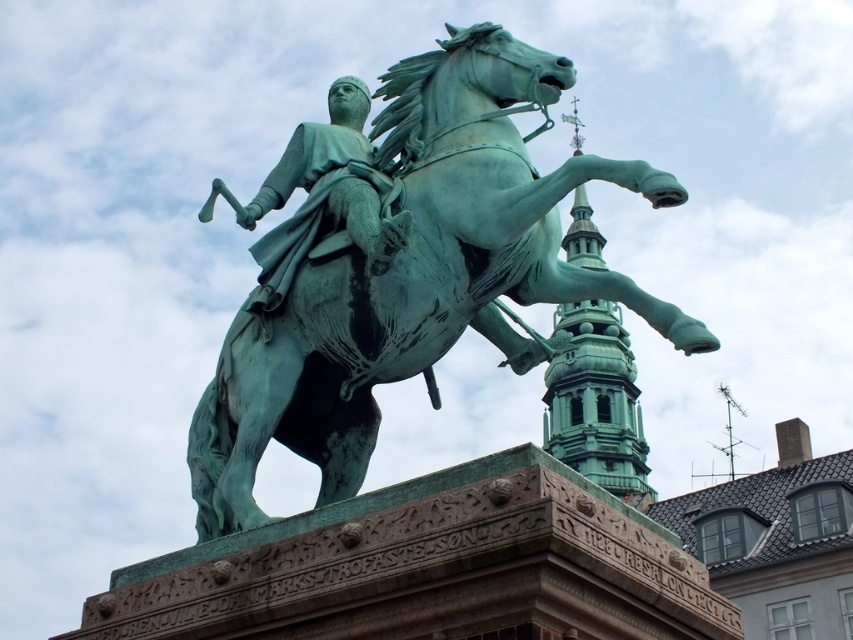
Does point (260, 192) lie in front of point (631, 481)?

Yes.

Identify the location of green patina horse at center. (413, 275).

Is green patinated bronze statue at center bigger than green patina tower at upper center?

No, green patinated bronze statue at center is not bigger than green patina tower at upper center.

Can you confirm if green patinated bronze statue at center is positioned above green patina tower at upper center?

Yes.

Is point (369, 259) in front of point (616, 467)?

Yes.

This screenshot has height=640, width=853. Identify the location of green patinated bronze statue at center. (326, 195).

Who is positioned more to the left, green patina horse at center or green patinated bronze statue at center?

Positioned to the left is green patinated bronze statue at center.

Can you confirm if green patina horse at center is positioned to the left of green patinated bronze statue at center?

No, green patina horse at center is not to the left of green patinated bronze statue at center.

In order to click on green patina horse at center in this screenshot , I will do `click(413, 275)`.